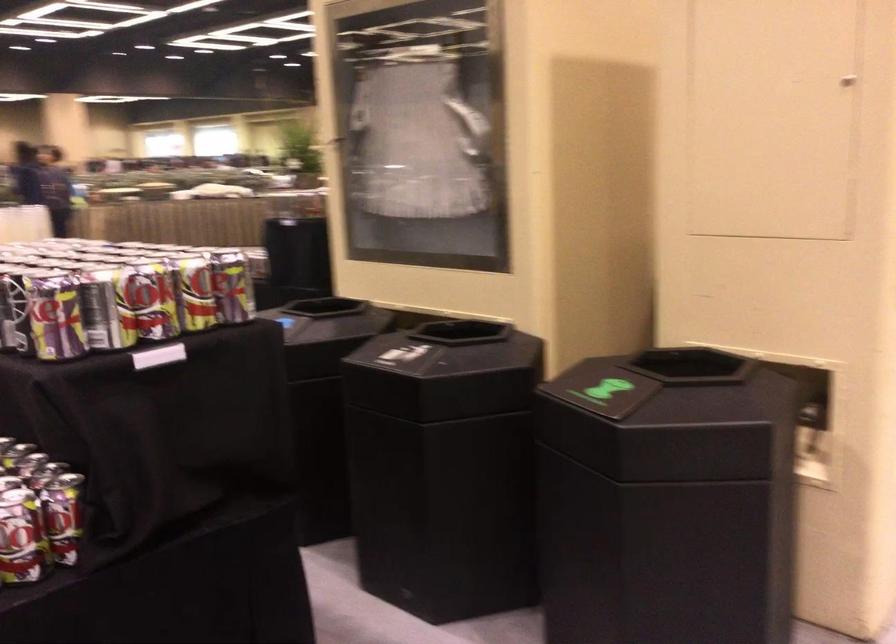
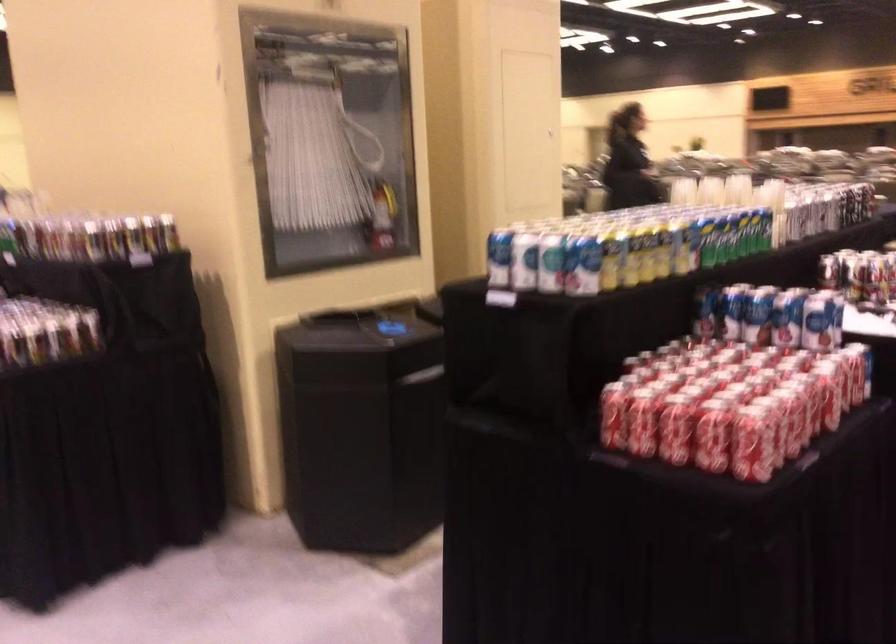
Question: I am providing you with two images of the same scene from different viewpoints. Which of the following objects are not visible in image2?

Choices:
 (A) blue and white can
 (B) metal can
 (C) red fire extinguisher
 (D) black bin opening

Answer: (D)